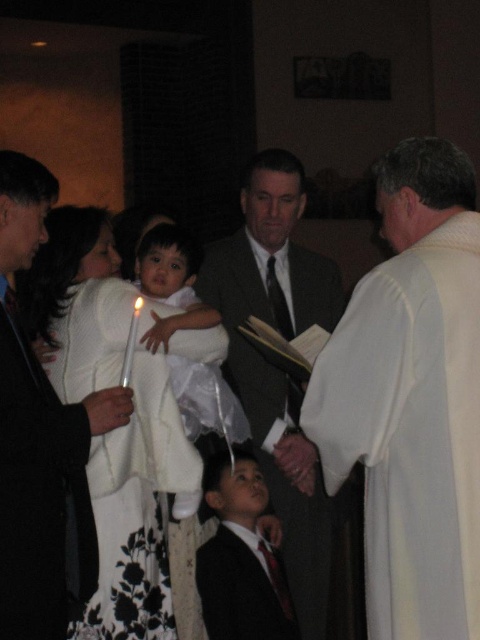
Consider the image. You are an event planner setting up for a ceremony. You need to place a decorative item between the white cloth at right and the white satin baby at center. Based on their positions, where should you place the item to ensure it is between them?

The white cloth at right is to the right of the white satin baby at center, so placing the decorative item between them would require positioning it to the left of the white cloth at right and to the right of the white satin baby at center.

You are an event photographer at this ceremony. You need to capture a closeup shot of both the white satin dress at center and the white satin baby at center. Given their sizes, which one should you focus on first to ensure it fits in the frame?

The white satin dress at center is larger in size than the white satin baby at center, so you should focus on capturing the white satin dress at center first to ensure it fits within the frame before adjusting for the smaller baby.